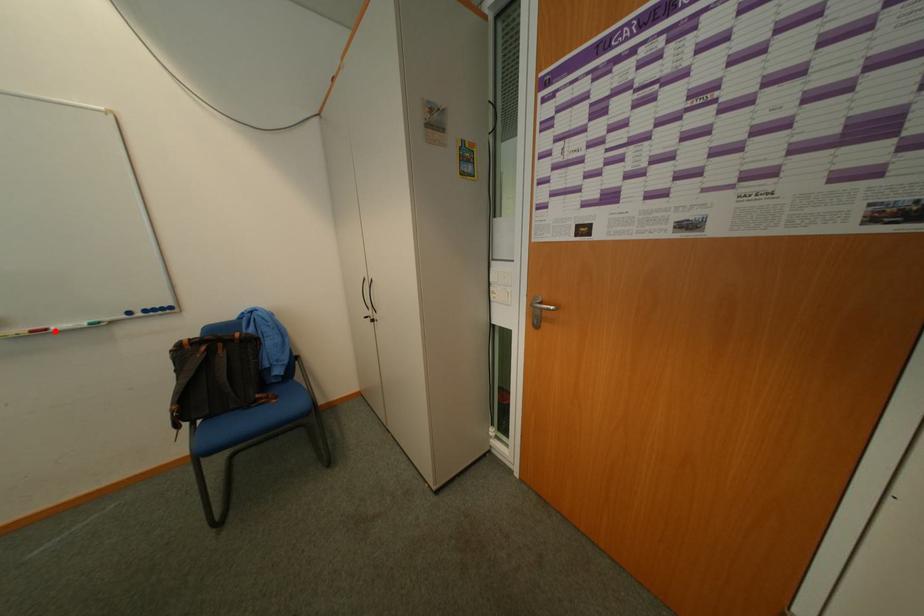
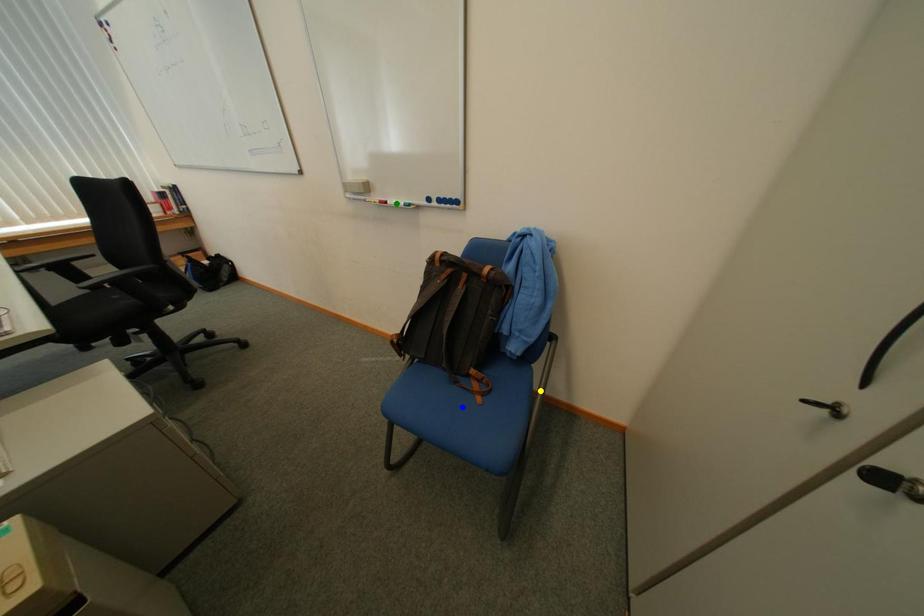
Question: I am providing you with two images of the same scene from different viewpoints. A red point is marked on the first image. You are given multiple points on the second image. In image 2, which mark is for the same physical point as the one in image 1?

Choices:
 (A) yellow point
 (B) blue point
 (C) green point

Answer: (C)